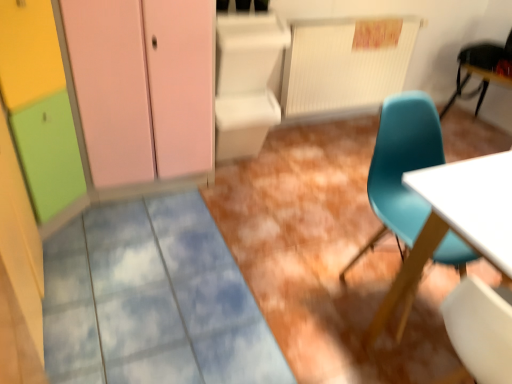
You are a GUI agent. You are given a task and a screenshot of the screen. Output one action in this format:
    pyautogui.click(x=<x>, y=<y>)
    Task: Click on the blank space to the left of matte plastic chair at right, the 2th chair in the top-to-bottom sequence
    This screenshot has height=384, width=512.
    Given the screenshot: What is the action you would take?
    pyautogui.click(x=305, y=314)